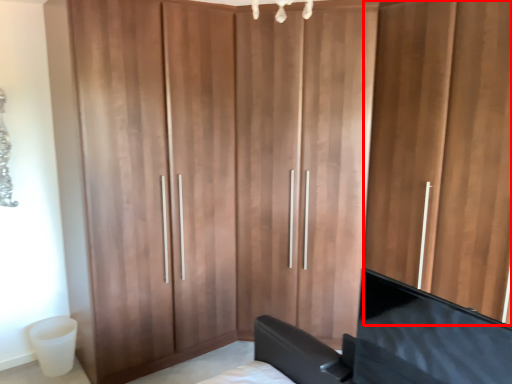
Question: In this image, where is door (annotated by the red box) located relative to flat?

Choices:
 (A) left
 (B) right

Answer: (B)